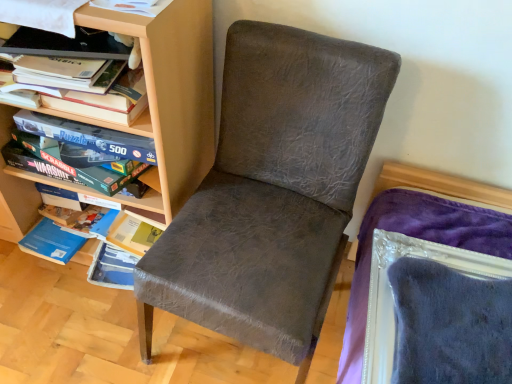
Identify the location of matte gray chair at center. (272, 190).

Can you confirm if matte gray chair at center is shorter than matte wood shelf at left?

Yes, matte gray chair at center is shorter than matte wood shelf at left.

Could you tell me if matte gray chair at center is turned towards matte wood shelf at left?

No, matte gray chair at center is not turned towards matte wood shelf at left.

Is matte gray chair at center placed right next to matte wood shelf at left?

They are not placed beside each other.

Considering the sizes of matte wood shelf at left and matte gray chair at center in the image, is matte wood shelf at left bigger or smaller than matte gray chair at center?

matte wood shelf at left is bigger than matte gray chair at center.

Considering the positions of point (51, 180) and point (302, 266), is point (51, 180) closer or farther from the camera than point (302, 266)?

Point (51, 180) is farther from the camera than point (302, 266).

How much distance is there between matte wood shelf at left and matte gray chair at center?

They are 9.84 inches apart.

Considering the points (56, 91) and (210, 273), which point is behind, point (56, 91) or point (210, 273)?

The point (56, 91) is farther.

From the picture: Does hardcover book at upper left appear on the right side of matte gray chair at center?

In fact, hardcover book at upper left is to the left of matte gray chair at center.

From the picture: Is hardcover book at upper left in contact with matte gray chair at center?

hardcover book at upper left and matte gray chair at center are not in contact.

From the image's perspective, between hardcover book at upper left and matte gray chair at center, which one is located above?

hardcover book at upper left appears higher in the image.

Is hardcover book at upper left placed right next to matte wood shelf at left?

No, hardcover book at upper left is not touching matte wood shelf at left.

Locate an element on the screen. This screenshot has width=512, height=384. shelf in front of the hardcover book at upper left is located at coordinates (168, 97).

From the image's perspective, does hardcover book at upper left appear higher than matte wood shelf at left?

Yes.

Considering the sizes of objects hardcover book at upper left and matte wood shelf at left in the image provided, who is taller, hardcover book at upper left or matte wood shelf at left?

matte wood shelf at left is taller.

Are matte gray chair at center and hardcover book at upper left located far from each other?

matte gray chair at center is actually quite close to hardcover book at upper left.

Is matte gray chair at center thinner than hardcover book at upper left?

In fact, matte gray chair at center might be wider than hardcover book at upper left.

Could you tell me if matte gray chair at center is facing hardcover book at upper left?

No, matte gray chair at center is not aimed at hardcover book at upper left.

Visually, is matte gray chair at center positioned to the left or to the right of hardcover book at upper left?

matte gray chair at center is to the right of hardcover book at upper left.

Does matte wood shelf at left have a larger size compared to hardcover book at upper left?

Yes, matte wood shelf at left is bigger than hardcover book at upper left.

Do you think matte wood shelf at left is within hardcover book at upper left, or outside of it?

matte wood shelf at left is not enclosed by hardcover book at upper left.

Between matte wood shelf at left and hardcover book at upper left, which one has larger width?

matte wood shelf at left is wider.

Is matte wood shelf at left facing towards hardcover book at upper left?

Yes, matte wood shelf at left is aimed at hardcover book at upper left.

The image size is (512, 384). What are the coordinates of `chair on the right of matte wood shelf at left` in the screenshot? It's located at (272, 190).

Locate an element on the screen. The width and height of the screenshot is (512, 384). chair directly beneath the matte wood shelf at left (from a real-world perspective) is located at coordinates (272, 190).

Based on the photo, which object lies nearer to the anchor point hardcover book at upper left, matte wood shelf at left or matte gray chair at center?

The object closer to hardcover book at upper left is matte wood shelf at left.

Looking at the image, which one is located closer to hardcover book at upper left, matte gray chair at center or matte wood shelf at left?

Based on the image, matte wood shelf at left appears to be nearer to hardcover book at upper left.

Considering their positions, is matte gray chair at center positioned closer to matte wood shelf at left than hardcover book at upper left?

Based on the image, hardcover book at upper left appears to be nearer to matte wood shelf at left.

Considering their positions, is hardcover book at upper left positioned closer to matte wood shelf at left than matte gray chair at center?

hardcover book at upper left is closer to matte wood shelf at left.

From the image, which object appears to be farther from matte gray chair at center, hardcover book at upper left or matte wood shelf at left?

hardcover book at upper left.

Looking at the image, which one is located closer to matte gray chair at center, matte wood shelf at left or hardcover book at upper left?

matte wood shelf at left is positioned closer to the anchor matte gray chair at center.

The height and width of the screenshot is (384, 512). Identify the location of book located between matte wood shelf at left and matte gray chair at center in the left-right direction. (88, 88).